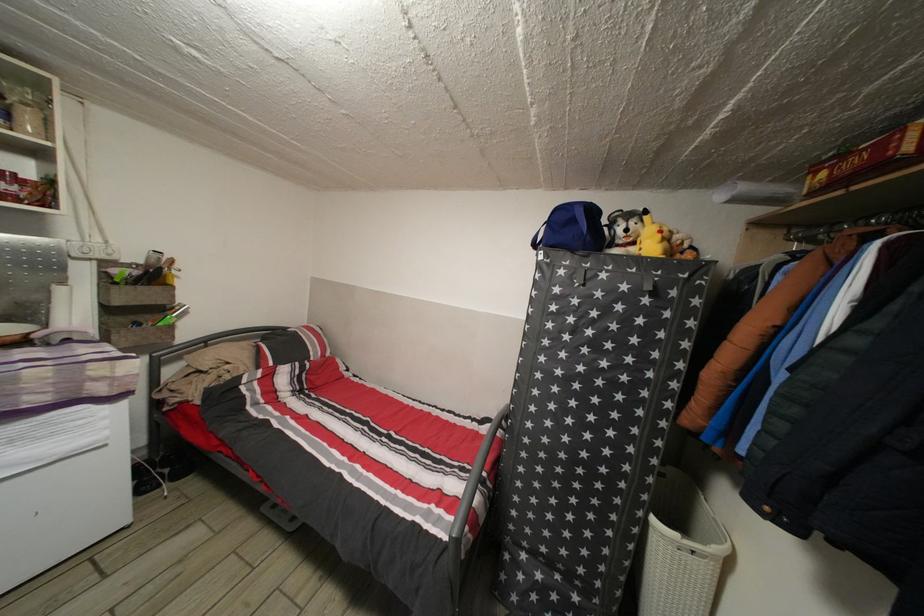
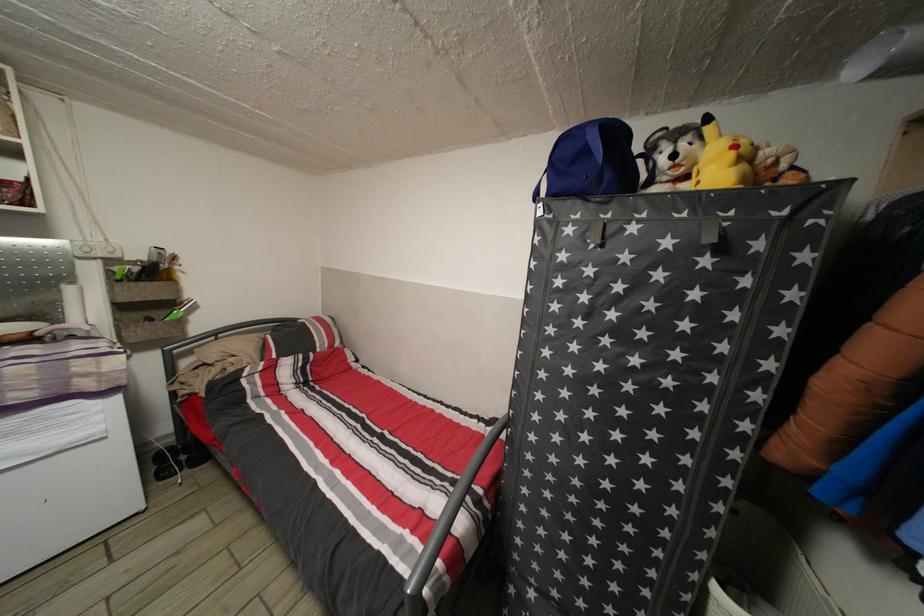
In the second image, find the point that corresponds to pixel 156 468 in the first image.

(177, 455)